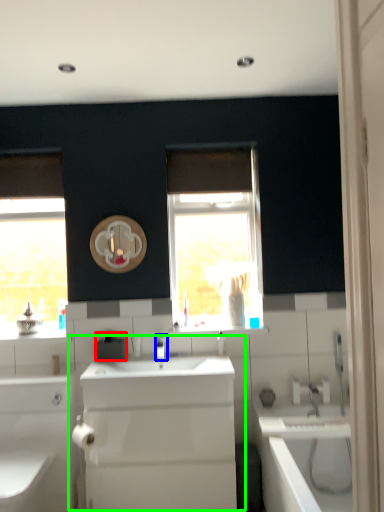
Question: Estimate the real-world distances between objects in this image. Which object is closer to appliance (highlighted by a red box), tap (highlighted by a blue box) or sink (highlighted by a green box)?

Choices:
 (A) tap
 (B) sink

Answer: (A)